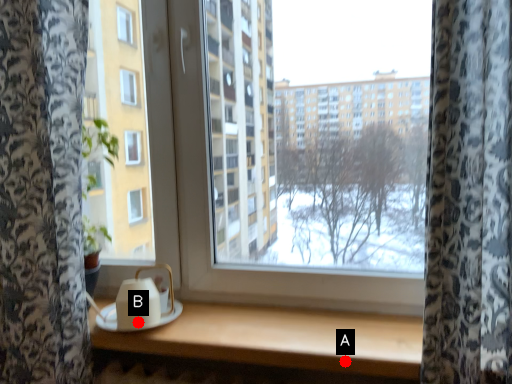
Question: Two points are circled on the image, labeled by A and B beside each circle. Which point appears closest to the camera in this image?

Choices:
 (A) A is closer
 (B) B is closer

Answer: (A)